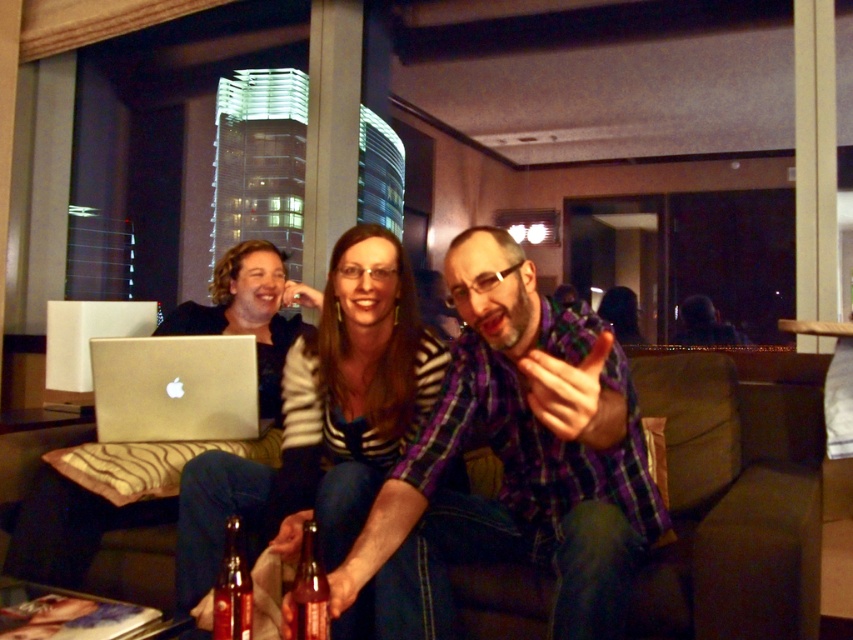
Question: Which object appears farthest from the camera in this image?

Choices:
 (A) metallic silver laptop at left
 (B) translucent glass bottle at center
 (C) purple plaid shirt at center
 (D) gold metallic laptop at center

Answer: (A)

Question: Is purple plaid shirt at center bigger than translucent glass bottle at center?

Choices:
 (A) no
 (B) yes

Answer: (B)

Question: Does translucent glass bottle at lower center have a smaller size compared to translucent glass bottle at center?

Choices:
 (A) no
 (B) yes

Answer: (A)

Question: Is purple plaid shirt at center thinner than translucent glass bottle at center?

Choices:
 (A) no
 (B) yes

Answer: (A)

Question: Which point is farther to the camera?

Choices:
 (A) translucent glass bottle at center
 (B) purple plaid shirt at center
 (C) translucent glass bottle at lower center
 (D) metallic silver laptop at left

Answer: (D)

Question: Which point is farther from the camera taking this photo?

Choices:
 (A) (248, 600)
 (B) (447, 561)
 (C) (746, 520)

Answer: (B)